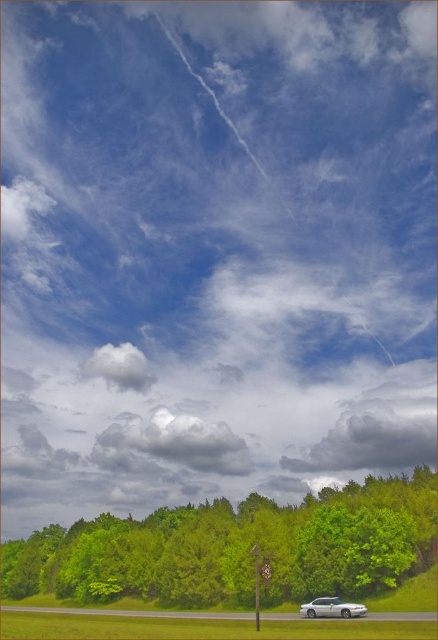
Question: Is green leafy tree at lower center thinner than white fluffy cloud at center?

Choices:
 (A) no
 (B) yes

Answer: (A)

Question: Which point is farther to the camera?

Choices:
 (A) white fluffy cloud at center
 (B) green leafy tree at lower center

Answer: (A)

Question: Does white fluffy cloud at center appear under white glossy sedan at lower center?

Choices:
 (A) yes
 (B) no

Answer: (A)

Question: From the image, what is the correct spatial relationship of green leafy tree at lower center in relation to white fluffy cloud at upper center?

Choices:
 (A) left
 (B) right

Answer: (B)

Question: Which point appears farthest from the camera in this image?

Choices:
 (A) (208, 547)
 (B) (103, 376)
 (C) (184, 433)

Answer: (B)

Question: Which of these objects is positioned farthest from the white fluffy cloud at upper center?

Choices:
 (A) white fluffy cloud at center
 (B) white glossy sedan at lower center
 (C) green leafy tree at lower center

Answer: (B)